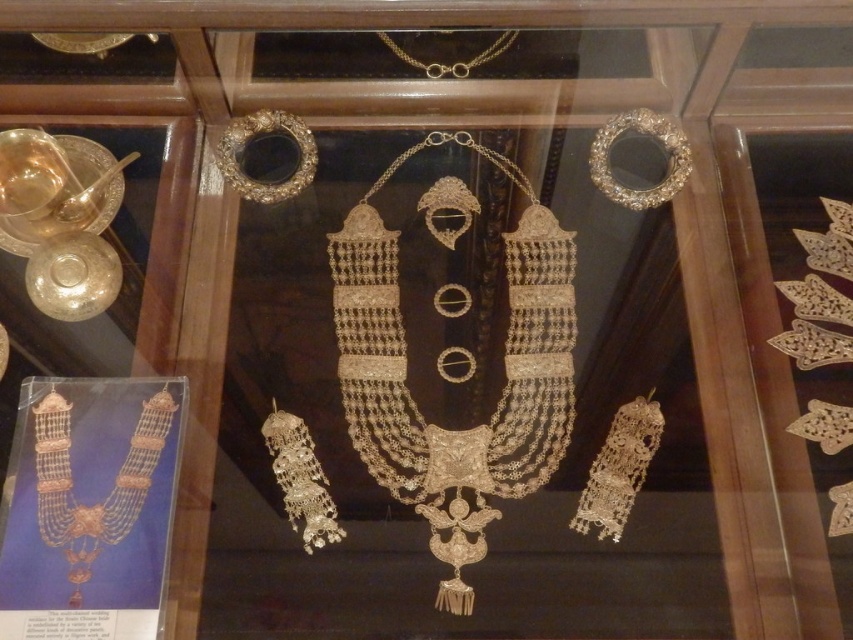
Question: Which of the following is the closest to the observer?

Choices:
 (A) silver textured earrings at right
 (B) gold textured necklace at lower left

Answer: (B)

Question: Does silver textured earrings at right appear over silver metallic bangle at upper right?

Choices:
 (A) yes
 (B) no

Answer: (B)

Question: Which point appears closest to the camera in this image?

Choices:
 (A) (78, 557)
 (B) (682, 164)
 (C) (395, 45)
 (D) (840, 227)

Answer: (A)

Question: Can you confirm if shiny gold necklace at center is wider than silver/metallic dangling earrings at lower left?

Choices:
 (A) no
 (B) yes

Answer: (B)

Question: Does silver textured earrings at right have a smaller size compared to shiny gold earring at center?

Choices:
 (A) yes
 (B) no

Answer: (B)

Question: Estimate the real-world distances between objects in this image. Which object is farther from the gold textured necklace at lower left?

Choices:
 (A) silver metallic bangle at upper right
 (B) silver textured earrings at right

Answer: (B)